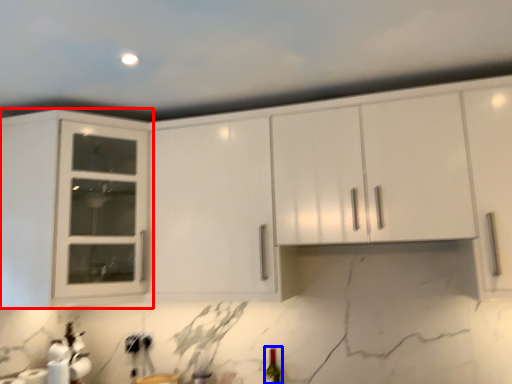
Question: Which point is further to the camera, cabinetry (highlighted by a red box) or wine bottle (highlighted by a blue box)?

Choices:
 (A) cabinetry
 (B) wine bottle

Answer: (B)